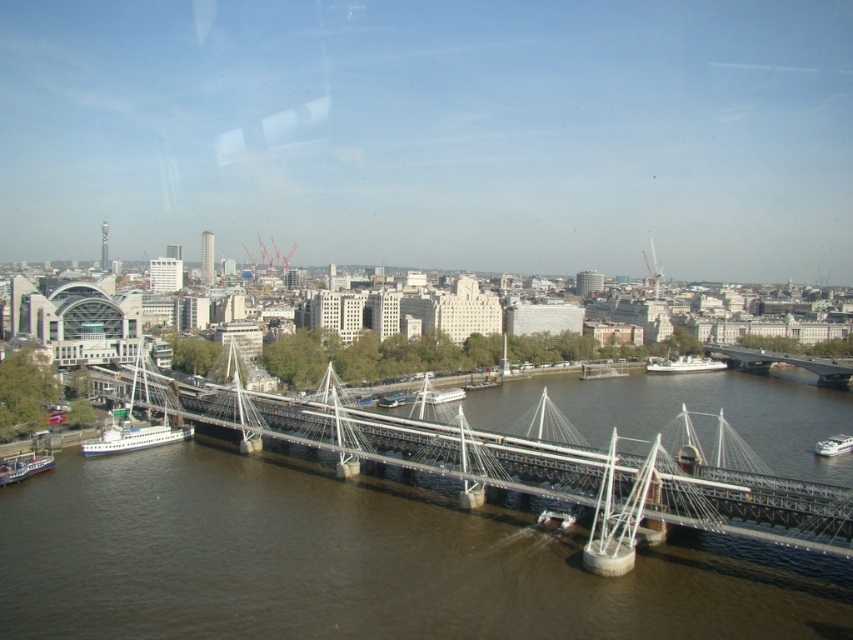
Question: From the image, what is the correct spatial relationship of green metallic boat at lower left in relation to green metallic boat at center?

Choices:
 (A) above
 (B) below

Answer: (B)

Question: Estimate the real-world distances between objects in this image. Which object is closer to the metallic gray bridge at center?

Choices:
 (A) white glossy boat at lower right
 (B) green metallic boat at lower left
 (C) green metallic boat at center
 (D) metallic gray suspension bridge at center

Answer: (C)

Question: Considering the real-world distances, which object is closest to the green metallic boat at lower left?

Choices:
 (A) metallic gray bridge at center
 (B) white glossy ferry at lower left
 (C) white glossy boat at lower right

Answer: (B)

Question: Is the position of metallic gray suspension bridge at center more distant than that of white glossy ferry at lower left?

Choices:
 (A) yes
 (B) no

Answer: (B)

Question: Does white glossy ferry at lower left lie in front of green metallic boat at center?

Choices:
 (A) yes
 (B) no

Answer: (A)

Question: Which of these objects is positioned farthest from the green metallic boat at lower left?

Choices:
 (A) metallic gray bridge at center
 (B) white glossy ferry at lower left
 (C) green metallic boat at center

Answer: (A)